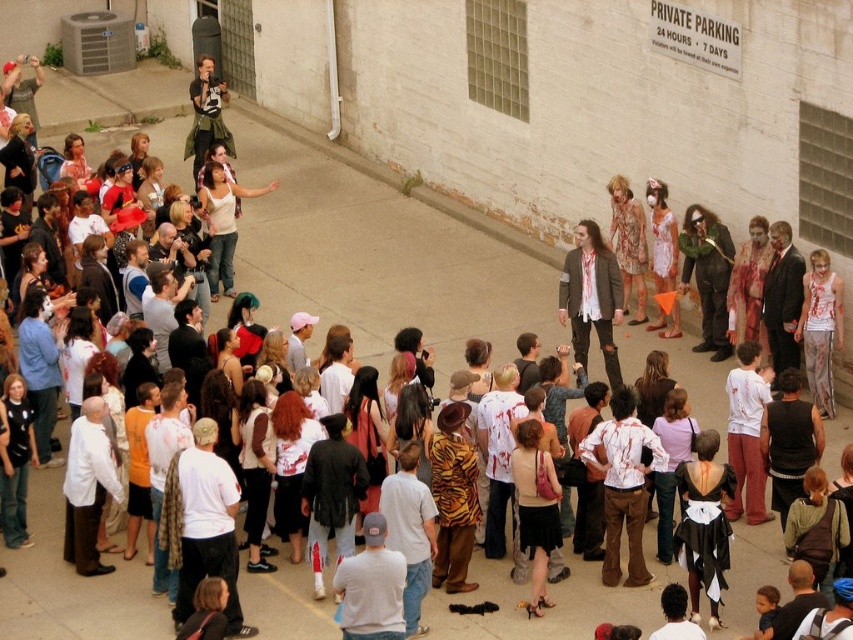
Question: Can you confirm if green fuzzy coat at center is positioned to the right of matte white dress at center?

Choices:
 (A) yes
 (B) no

Answer: (A)

Question: Does blood-stained cotton shirt at center appear under matte black jacket at upper left?

Choices:
 (A) yes
 (B) no

Answer: (A)

Question: Which of the following is the closest to the observer?

Choices:
 (A) click(224, 225)
 (B) click(663, 184)
 (C) click(718, 324)
 (D) click(642, 221)

Answer: (C)

Question: Can you confirm if matte white dress at center is thinner than matte black jacket at upper left?

Choices:
 (A) yes
 (B) no

Answer: (A)

Question: Which point is closer to the camera?

Choices:
 (A) white tank top at center
 (B) matte black jacket at upper left
 (C) floral dress at center
 (D) ripped denim jeans at center

Answer: (D)

Question: Which point appears closest to the camera in this image?

Choices:
 (A) (216, 81)
 (B) (714, 228)
 (C) (653, 186)
 (D) (618, 320)

Answer: (D)